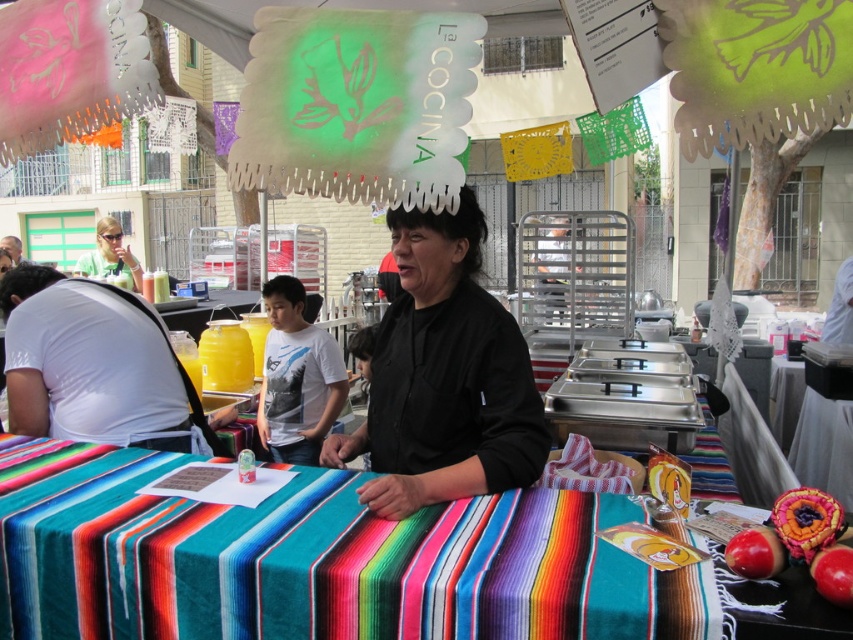
Based on the photo, you are a customer at the market and want to buy both the black matte shirt at center and the red matte apple at lower right. Which item is bigger?

The black matte shirt at center is larger in size compared to the red matte apple at lower right.

You are a customer at the market and want to grab the red matte apple at lower right from the table. The vendor is wearing a black matte shirt at center. Can you reach the apple without moving closer to the vendor?

The black matte shirt at center is further to the viewer than red matte apple at lower right, so the apple is closer to you. Since the apple is closer, you can reach it without moving closer to the vendor.

You are a customer at the market and want to pick up an item from the table. The multicolored woven cloth at center and the black matte shirt at center are both on the table. Which one is located to the left?

The multicolored woven cloth at center is to the left of the black matte shirt at center.